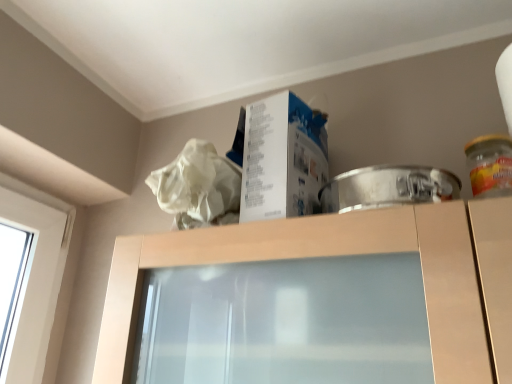
Question: Considering the relative sizes of white paperboard box at upper center and translucent glass jar at right in the image provided, is white paperboard box at upper center thinner than translucent glass jar at right?

Choices:
 (A) no
 (B) yes

Answer: (A)

Question: Is white paperboard box at upper center facing towards translucent glass jar at right?

Choices:
 (A) no
 (B) yes

Answer: (A)

Question: Is translucent glass jar at right a part of white paperboard box at upper center?

Choices:
 (A) no
 (B) yes

Answer: (A)

Question: Does white paperboard box at upper center lie behind translucent glass jar at right?

Choices:
 (A) yes
 (B) no

Answer: (A)

Question: From the image's perspective, would you say white paperboard box at upper center is positioned over translucent glass jar at right?

Choices:
 (A) no
 (B) yes

Answer: (B)

Question: Considering the relative sizes of white paperboard box at upper center and translucent glass jar at right in the image provided, is white paperboard box at upper center smaller than translucent glass jar at right?

Choices:
 (A) yes
 (B) no

Answer: (B)

Question: Is translucent glass jar at right wider than white paperboard box at upper center?

Choices:
 (A) no
 (B) yes

Answer: (A)

Question: Is white paperboard box at upper center inside translucent glass jar at right?

Choices:
 (A) no
 (B) yes

Answer: (A)

Question: From the image's perspective, would you say translucent glass jar at right is positioned over white paperboard box at upper center?

Choices:
 (A) yes
 (B) no

Answer: (B)

Question: Would you consider translucent glass jar at right to be distant from white paperboard box at upper center?

Choices:
 (A) yes
 (B) no

Answer: (B)

Question: Considering the relative positions of translucent glass jar at right and white paperboard box at upper center in the image provided, is translucent glass jar at right behind white paperboard box at upper center?

Choices:
 (A) no
 (B) yes

Answer: (A)

Question: Is translucent glass jar at right shorter than white paperboard box at upper center?

Choices:
 (A) yes
 (B) no

Answer: (A)

Question: Is white paperboard box at upper center in front of or behind translucent glass jar at right in the image?

Choices:
 (A) behind
 (B) front

Answer: (A)